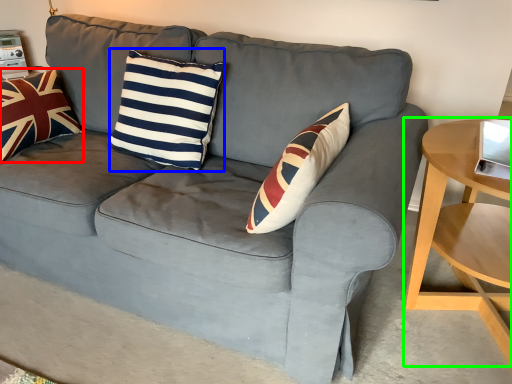
Question: Which object is the farthest from pillow (highlighted by a red box)? Choose among these: pillow (highlighted by a blue box) or table (highlighted by a green box).

Choices:
 (A) pillow
 (B) table

Answer: (B)